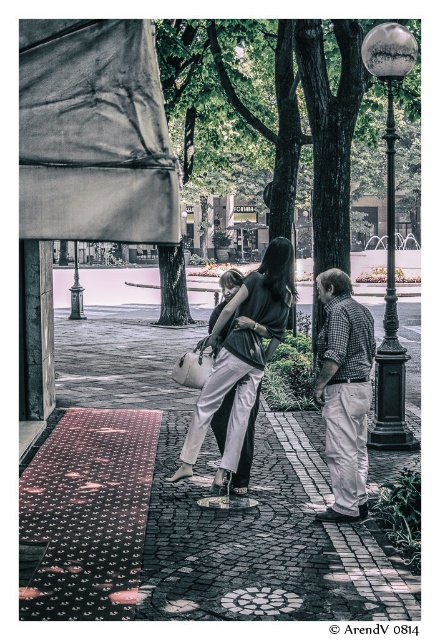
Question: Based on their relative distances, which object is farther from the checkered fabric shirt at center?

Choices:
 (A) matte black jacket at center
 (B) polished stone pavement at center
 (C) matte gray fabric canopy at upper left

Answer: (C)

Question: Estimate the real-world distances between objects in this image. Which object is farther from the checkered fabric shirt at center?

Choices:
 (A) matte gray fabric canopy at upper left
 (B) shiny black pole at right
 (C) matte black jacket at center

Answer: (A)

Question: Is polished stone pavement at center wider than matte gray fabric canopy at upper left?

Choices:
 (A) no
 (B) yes

Answer: (B)

Question: Which of the following is the farthest from the observer?

Choices:
 (A) matte gray fabric canopy at upper left
 (B) polished stone pavement at center

Answer: (B)

Question: Does checkered fabric shirt at center come in front of shiny black pole at right?

Choices:
 (A) no
 (B) yes

Answer: (B)

Question: From the image, what is the correct spatial relationship of polished stone pavement at center in relation to matte gray fabric canopy at upper left?

Choices:
 (A) left
 (B) right

Answer: (B)